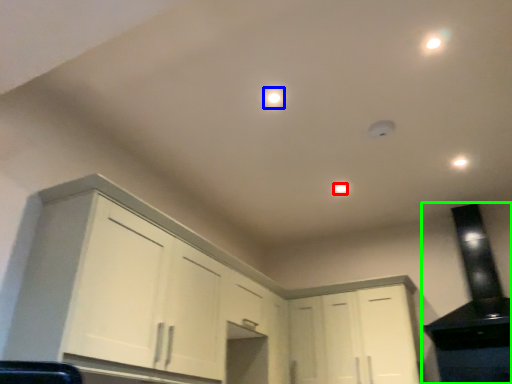
Question: Based on their relative distances, which object is farther from dot (highlighted by a red box)? Choose from dot (highlighted by a blue box) and appliance (highlighted by a green box).

Choices:
 (A) dot
 (B) appliance

Answer: (B)